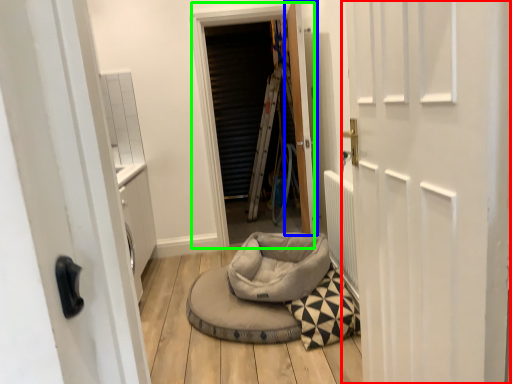
Question: Which object is the farthest from door (highlighted by a red box)? Choose among these: door (highlighted by a blue box) or window screen (highlighted by a green box).

Choices:
 (A) door
 (B) window screen

Answer: (B)